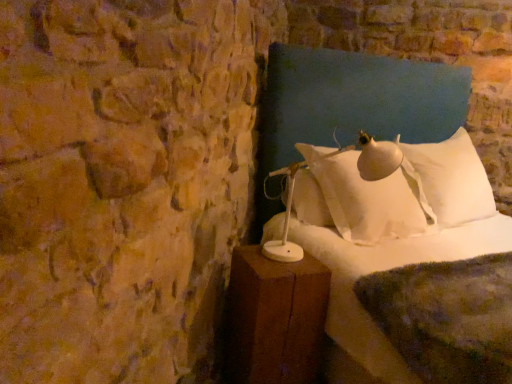
Identify the location of blank space situated above brown wooden nightstand at lower right (from a real-world perspective). This screenshot has height=384, width=512. (280, 262).